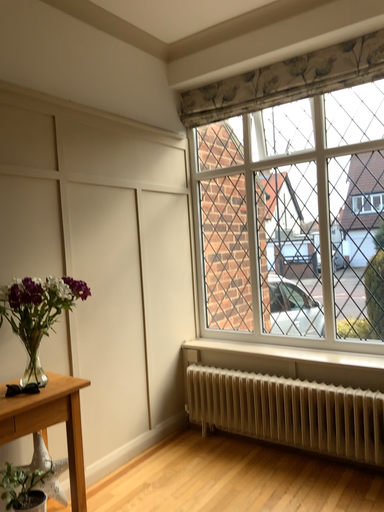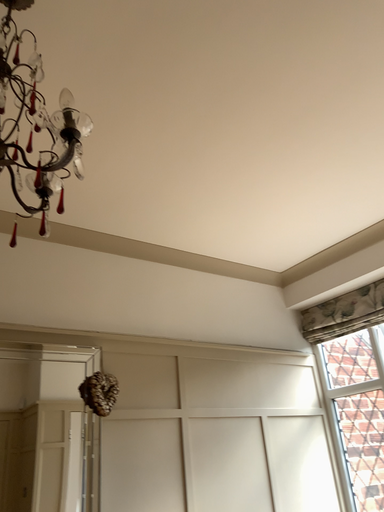
Question: How did the camera likely rotate when shooting the video?

Choices:
 (A) rotated upward
 (B) rotated downward

Answer: (A)